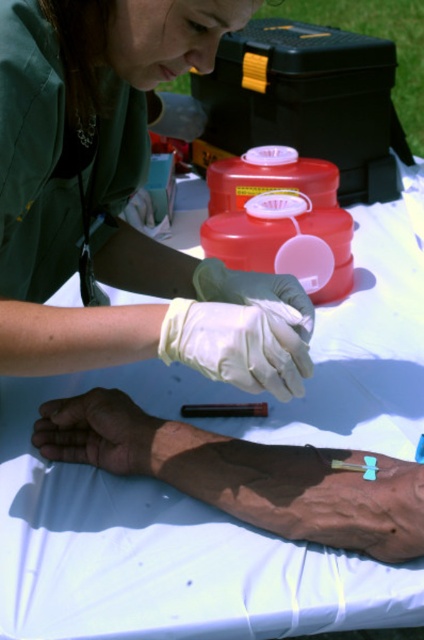
Which is below, matte green uniform at upper left or blue latex glove at center?

blue latex glove at center is below.

Who is more forward, (130,3) or (225,288)?

Positioned in front is point (130,3).

Find the location of a particular element. matte green uniform at upper left is located at coordinates (119, 202).

Is white leather glove at center bigger than blue latex glove at center?

Incorrect, white leather glove at center is not larger than blue latex glove at center.

Does white leather glove at center appear on the left side of blue latex glove at center?

Incorrect, white leather glove at center is not on the left side of blue latex glove at center.

Which is behind, point (296, 346) or point (304, 328)?

The point (304, 328) is behind.

The image size is (424, 640). In order to click on white leather glove at center in this screenshot , I will do `click(239, 342)`.

Does matte green uniform at upper left have a greater width compared to white leather glove at center?

Yes.

Who is more forward, (103,72) or (261,332)?

Point (261,332) is in front.

This screenshot has height=640, width=424. Identify the location of matte green uniform at upper left. (119, 202).